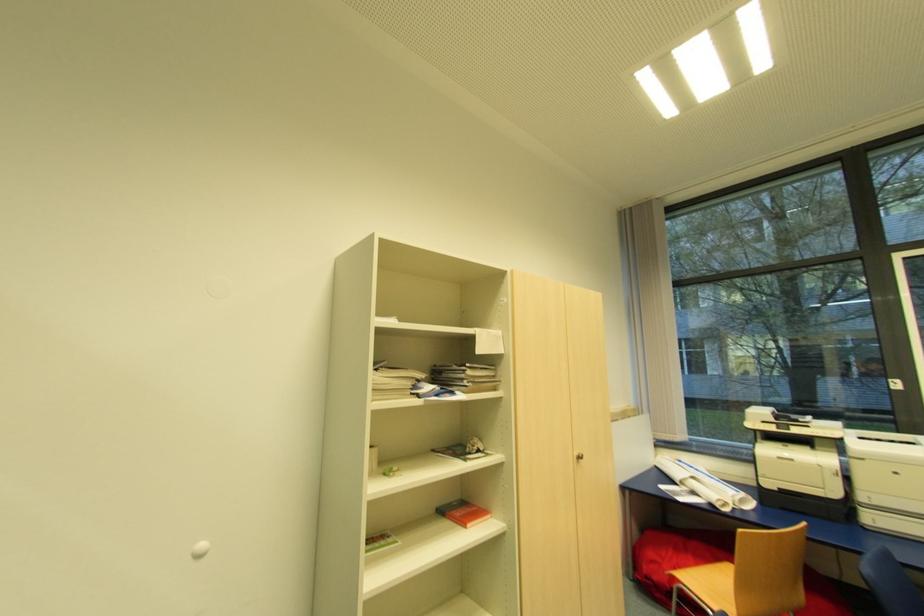
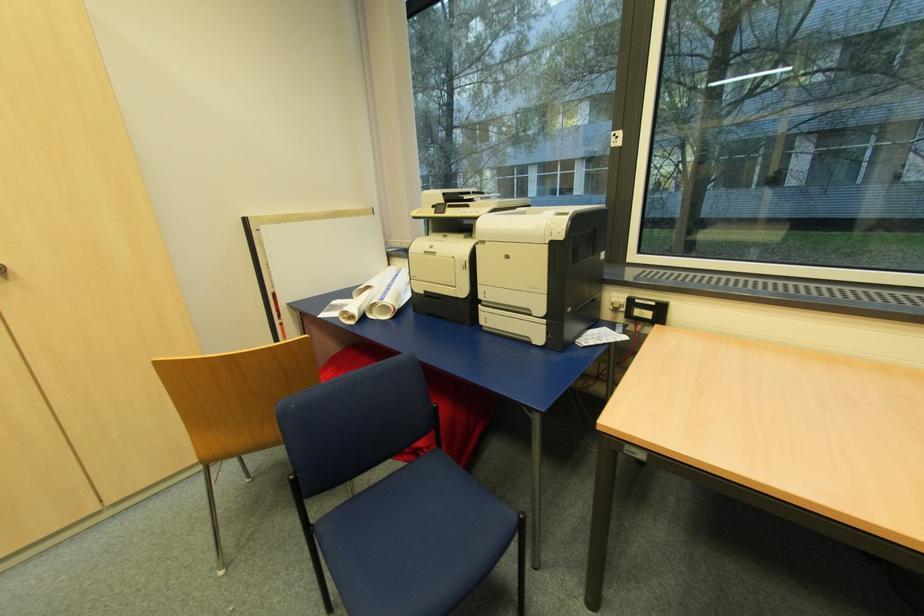
Question: What movement of the cameraman would produce the second image?

Choices:
 (A) Left
 (B) Right
 (C) Forward
 (D) Backward

Answer: (B)